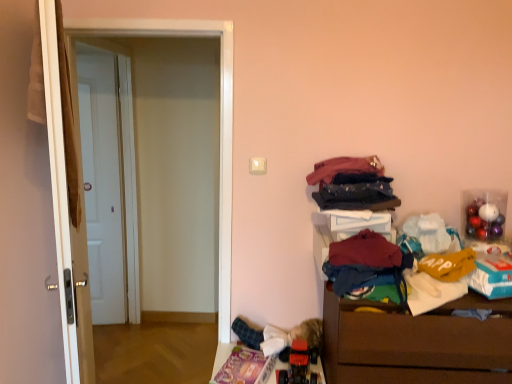
What is the approximate height of white glossy door at left?

6.16 feet.

Identify the location of dark blue denim jeans at upper right, positioned as the third clothing in bottom-to-top order. (344, 168).

What do you see at coordinates (367, 264) in the screenshot? I see `dark red fabric at lower right, arranged as the third clothing when viewed from the top` at bounding box center [367, 264].

The height and width of the screenshot is (384, 512). Describe the element at coordinates (106, 181) in the screenshot. I see `white matte door at left, which appears as the 1th door when viewed from the left` at that location.

The height and width of the screenshot is (384, 512). In order to click on brown wooden chest of drawers at lower right in this screenshot , I will do click(415, 342).

Measure the distance between point (52,94) and camera.

1.27 meters.

Describe the element at coordinates (298, 365) in the screenshot. This screenshot has height=384, width=512. I see `red plastic toy car at lower center` at that location.

The image size is (512, 384). What are the coordinates of `white glossy door at left` in the screenshot? It's located at (220, 121).

In the image, is white glossy door at left, arranged as the second door when viewed from the back, positioned in front of or behind red plastic toy car at lower center?

Visually, white glossy door at left, arranged as the second door when viewed from the back, is located in front of red plastic toy car at lower center.

Does white glossy door at left, acting as the 1th door starting from the front, appear on the right side of red plastic toy car at lower center?

No.

Considering the sizes of objects white glossy door at left, arranged as the second door when viewed from the back, and red plastic toy car at lower center in the image provided, who is taller, white glossy door at left, arranged as the second door when viewed from the back, or red plastic toy car at lower center?

Standing taller between the two is white glossy door at left, arranged as the second door when viewed from the back.

Is white glossy door at left, the second door when ordered from left to right, bigger or smaller than red plastic toy car at lower center?

Clearly, white glossy door at left, the second door when ordered from left to right, is larger in size than red plastic toy car at lower center.

Can you tell me how much white glossy door at left, the 1th door in the right-to-left sequence, and dark blue denim jeans at upper right, positioned as the third clothing in bottom-to-top order, differ in facing direction?

white glossy door at left, the 1th door in the right-to-left sequence, and dark blue denim jeans at upper right, positioned as the third clothing in bottom-to-top order, are facing 114 degrees away from each other.

Choose the correct answer: Is white glossy door at left, the 1th door in the right-to-left sequence, inside dark blue denim jeans at upper right, positioned as the third clothing in bottom-to-top order, or outside it?

white glossy door at left, the 1th door in the right-to-left sequence, is not enclosed by dark blue denim jeans at upper right, positioned as the third clothing in bottom-to-top order.

In the scene shown: Is white glossy door at left, the 1th door in the right-to-left sequence, facing away from dark blue denim jeans at upper right, positioned as the third clothing in bottom-to-top order?

No, white glossy door at left, the 1th door in the right-to-left sequence, is not facing the opposite direction of dark blue denim jeans at upper right, positioned as the third clothing in bottom-to-top order.

Is the position of white glossy door at left, the 1th door in the right-to-left sequence, more distant than that of dark blue denim jeans at upper right, positioned as the third clothing in bottom-to-top order?

No, it is not.

From a real-world perspective, which is physically below, dark blue denim jeans at upper right, positioned as the third clothing in bottom-to-top order, or red plastic toy car at lower center?

From a 3D spatial view, red plastic toy car at lower center is below.

How different are the orientations of dark blue denim jeans at upper right, which is the 1th clothing from top to bottom, and red plastic toy car at lower center in degrees?

4.24 degrees separate the facing orientations of dark blue denim jeans at upper right, which is the 1th clothing from top to bottom, and red plastic toy car at lower center.

From the image's perspective, which one is positioned higher, dark blue denim jeans at upper right, which is the 1th clothing from top to bottom, or red plastic toy car at lower center?

dark blue denim jeans at upper right, which is the 1th clothing from top to bottom, from the image's perspective.

This screenshot has height=384, width=512. In order to click on the 3rd clothing above the red plastic toy car at lower center (from the image's perspective) in this screenshot , I will do `click(344, 168)`.

Looking at this image, from the image's perspective, does brown wooden chest of drawers at lower right appear higher than dark blue denim jeans at upper right, which is the 1th clothing from top to bottom?

Actually, brown wooden chest of drawers at lower right appears below dark blue denim jeans at upper right, which is the 1th clothing from top to bottom, in the image.

Looking at their sizes, would you say brown wooden chest of drawers at lower right is wider or thinner than dark blue denim jeans at upper right, positioned as the third clothing in bottom-to-top order?

brown wooden chest of drawers at lower right is wider than dark blue denim jeans at upper right, positioned as the third clothing in bottom-to-top order.

Does brown wooden chest of drawers at lower right appear on the right side of dark blue denim jeans at upper right, positioned as the third clothing in bottom-to-top order?

Yes.

In the scene shown: Is dark blue denim jeans at upper right, positioned as the third clothing in bottom-to-top order, surrounded by brown wooden chest of drawers at lower right?

No, dark blue denim jeans at upper right, positioned as the third clothing in bottom-to-top order, is not surrounded by brown wooden chest of drawers at lower right.

Could you measure the distance between white matte door at left, which appears as the 2th door when viewed from the front, and brown wooden chest of drawers at lower right?

white matte door at left, which appears as the 2th door when viewed from the front, is 2.17 meters from brown wooden chest of drawers at lower right.

Which is more to the left, white matte door at left, the second door positioned from the right, or brown wooden chest of drawers at lower right?

white matte door at left, the second door positioned from the right.

Is point (94, 320) farther from viewer compared to point (492, 345)?

Yes, point (94, 320) is behind point (492, 345).

Between white matte door at left, which appears as the 1th door when viewed from the left, and brown wooden chest of drawers at lower right, which one has larger width?

brown wooden chest of drawers at lower right is wider.

Based on the photo, from the image's perspective, is brown wooden chest of drawers at lower right above or below dark blue fabric at upper right, the second clothing ordered from the bottom?

brown wooden chest of drawers at lower right is below dark blue fabric at upper right, the second clothing ordered from the bottom.

Could you measure the distance between brown wooden chest of drawers at lower right and dark blue fabric at upper right, positioned as the 2th clothing in top-to-bottom order?

brown wooden chest of drawers at lower right and dark blue fabric at upper right, positioned as the 2th clothing in top-to-bottom order, are 19.28 inches apart from each other.

From a real-world perspective, is brown wooden chest of drawers at lower right positioned over dark blue fabric at upper right, positioned as the 2th clothing in top-to-bottom order, based on gravity?

Actually, brown wooden chest of drawers at lower right is physically below dark blue fabric at upper right, positioned as the 2th clothing in top-to-bottom order, in the real world.

Is point (443, 361) closer or farther from the camera than point (389, 202)?

Clearly, point (443, 361) is closer to the camera than point (389, 202).

Are red plastic toy car at lower center and white matte door at left, the first door from the back, far apart?

Absolutely, red plastic toy car at lower center is distant from white matte door at left, the first door from the back.

Would you say red plastic toy car at lower center is to the left or to the right of white matte door at left, the first door from the back, in the picture?

Based on their positions, red plastic toy car at lower center is located to the right of white matte door at left, the first door from the back.

Do you think red plastic toy car at lower center is within white matte door at left, the first door from the back, or outside of it?

red plastic toy car at lower center is not enclosed by white matte door at left, the first door from the back.

From the image's perspective, between red plastic toy car at lower center and white matte door at left, the second door positioned from the right, who is located below?

red plastic toy car at lower center, from the image's perspective.

At what (x,y) coordinates should I click in order to perform the action: click on toy on the right of white glossy door at left, the second door when ordered from left to right. Please return your answer as a coordinate pair (x, y). The width and height of the screenshot is (512, 384). Looking at the image, I should click on (298, 365).

There is a dark blue denim jeans at upper right, positioned as the third clothing in bottom-to-top order. At what (x,y) coordinates should I click in order to perform the action: click on the 1st door below it (from a real-world perspective). Please return your answer as a coordinate pair (x, y). The width and height of the screenshot is (512, 384). Looking at the image, I should click on pyautogui.click(x=66, y=215).

Which object lies further to the anchor point white glossy door at left, dark red fabric at lower right, arranged as the third clothing when viewed from the top, or brown wooden chest of drawers at lower right?

brown wooden chest of drawers at lower right is positioned further to the anchor white glossy door at left.

Which object lies further to the anchor point dark blue fabric at upper right, the second clothing ordered from the bottom, brown wooden chest of drawers at lower right or white matte door at left, which appears as the 1th door when viewed from the left?

white matte door at left, which appears as the 1th door when viewed from the left, is further to dark blue fabric at upper right, the second clothing ordered from the bottom.

From the image, which object appears to be nearer to dark blue fabric at upper right, positioned as the 2th clothing in top-to-bottom order, white matte door at left, the first door from the back, or red plastic toy car at lower center?

red plastic toy car at lower center.

From the image, which object appears to be nearer to dark blue denim jeans at upper right, which is the 1th clothing from top to bottom, white matte door at left, the first door from the back, or white glossy door at left?

Among the two, white glossy door at left is located nearer to dark blue denim jeans at upper right, which is the 1th clothing from top to bottom.

When comparing their distances from dark blue fabric at upper right, positioned as the 2th clothing in top-to-bottom order, does white glossy door at left, arranged as the second door when viewed from the back, or red plastic toy car at lower center seem further?

white glossy door at left, arranged as the second door when viewed from the back, is positioned further to the anchor dark blue fabric at upper right, positioned as the 2th clothing in top-to-bottom order.

Looking at the image, which one is located closer to dark blue fabric at upper right, positioned as the 2th clothing in top-to-bottom order, dark blue denim jeans at upper right, which is the 1th clothing from top to bottom, or brown wooden chest of drawers at lower right?

Among the two, dark blue denim jeans at upper right, which is the 1th clothing from top to bottom, is located nearer to dark blue fabric at upper right, positioned as the 2th clothing in top-to-bottom order.

Looking at the image, which one is located closer to dark blue denim jeans at upper right, positioned as the third clothing in bottom-to-top order, dark red fabric at lower right, which appears as the 1th clothing when ordered from the bottom, or brown wooden chest of drawers at lower right?

dark red fabric at lower right, which appears as the 1th clothing when ordered from the bottom.

From the image, which object appears to be farther from dark blue fabric at upper right, the second clothing ordered from the bottom, dark red fabric at lower right, which appears as the 1th clothing when ordered from the bottom, or brown wooden chest of drawers at lower right?

brown wooden chest of drawers at lower right is further to dark blue fabric at upper right, the second clothing ordered from the bottom.

This screenshot has width=512, height=384. Identify the location of screen door between white glossy door at left, the 1th door in the right-to-left sequence, and brown wooden chest of drawers at lower right. (220, 121).

Identify the location of screen door between white matte door at left, which appears as the 2th door when viewed from the front, and dark red fabric at lower right, which appears as the 1th clothing when ordered from the bottom, from left to right. Image resolution: width=512 pixels, height=384 pixels. (220, 121).

Identify the location of toy located between white glossy door at left and dark blue denim jeans at upper right, which is the 1th clothing from top to bottom, in the left-right direction. (298, 365).

Locate an element on the screen. Image resolution: width=512 pixels, height=384 pixels. toy situated between white matte door at left, which appears as the 2th door when viewed from the front, and brown wooden chest of drawers at lower right from left to right is located at coordinates (298, 365).